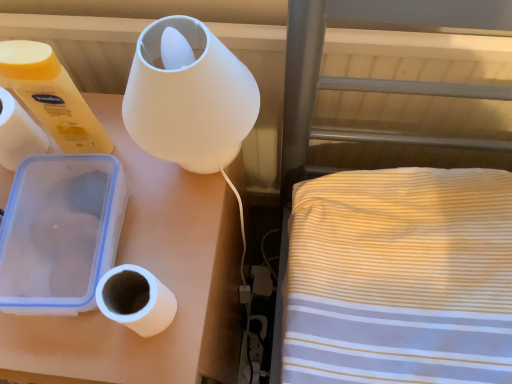
You are a GUI agent. You are given a task and a screenshot of the screen. Output one action in this format:
    pyautogui.click(x=<x>, y=<y>)
    Task: Click on the empty space that is in between frosted glass lamp at upper center and white matte toilet paper at lower left, the second toilet paper viewed from the top
    The width and height of the screenshot is (512, 384).
    Given the screenshot: What is the action you would take?
    pyautogui.click(x=184, y=255)